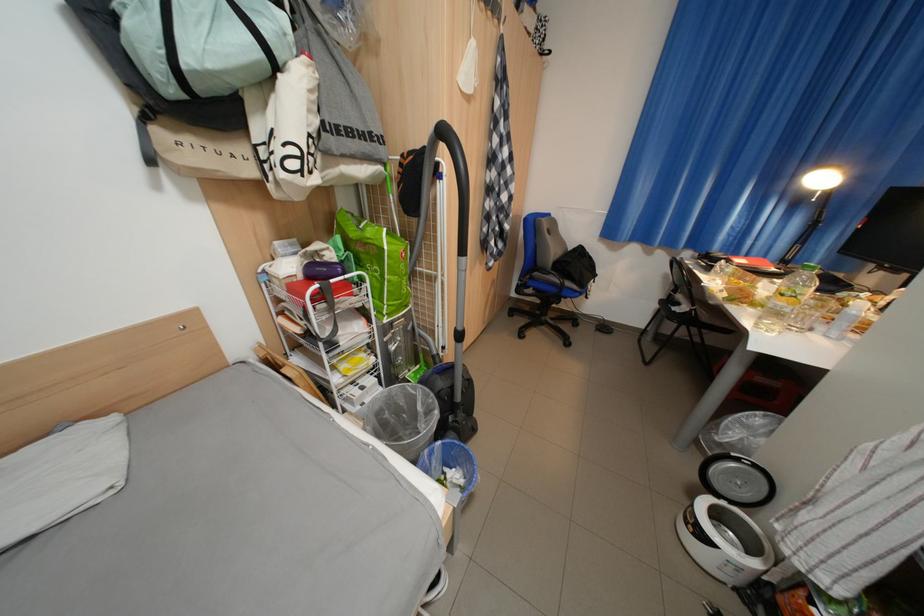
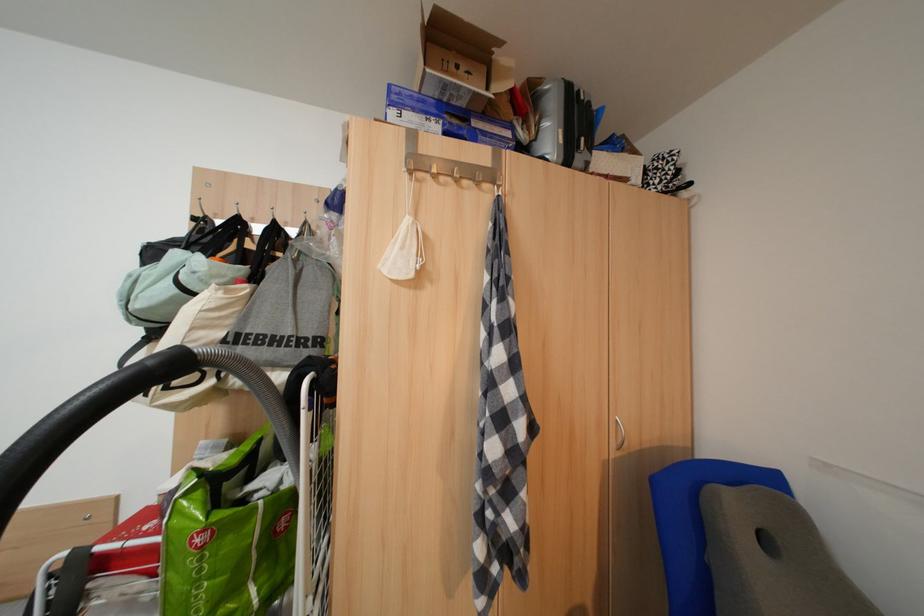
In the second image, find the point that corresponds to point 322,87 in the first image.

(224, 307)